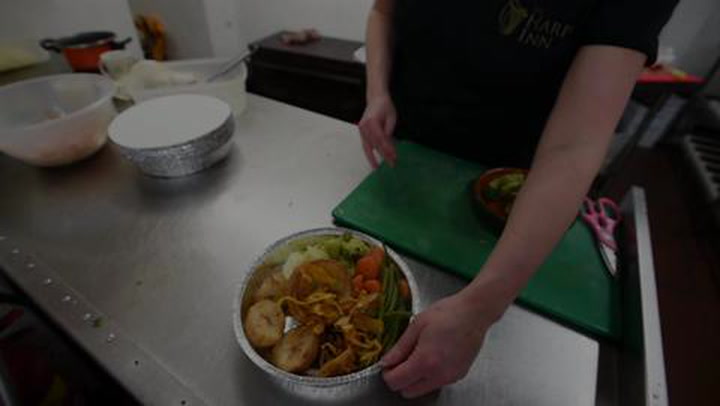
Identify the location of empty dark floor space. (65, 378).